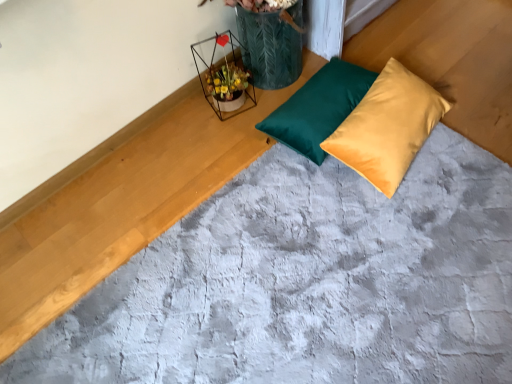
Locate an element on the screen. free location in front of satin yellow pillow at center, the second pillow when ordered from left to right is located at coordinates (420, 236).